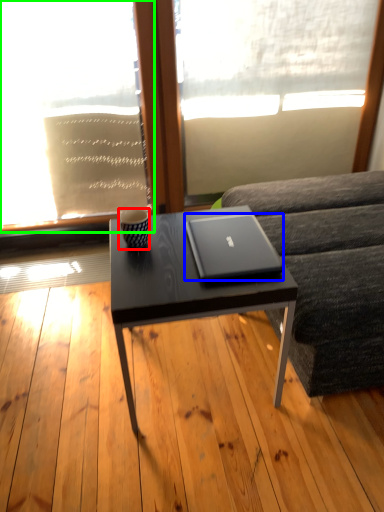
Question: Which object is the farthest from coffee cup (highlighted by a red box)? Choose among these: laptop (highlighted by a blue box) or window screen (highlighted by a green box).

Choices:
 (A) laptop
 (B) window screen

Answer: (B)